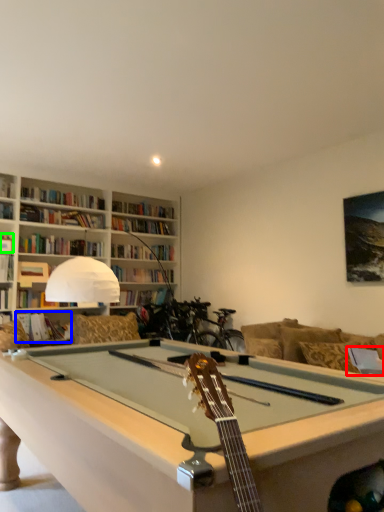
Question: Which object is the closest to the pillow (highlighted by a red box)? Choose among these: book (highlighted by a blue box) or book (highlighted by a green box).

Choices:
 (A) book
 (B) book

Answer: (A)